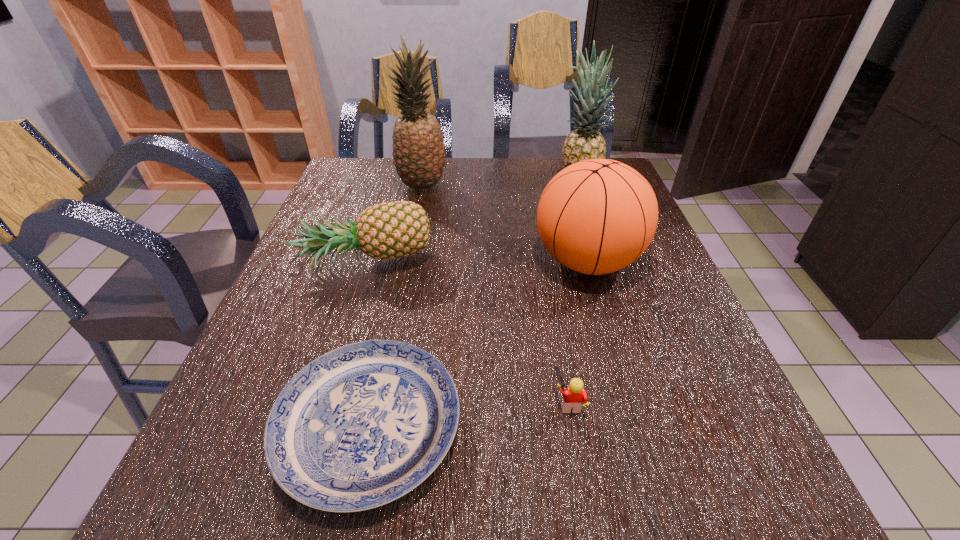
Identify the location of blank area located in front of the Lego with the accessory visible. (462, 402).

Identify the location of vacant space located in front of the Lego with the accessory visible. The height and width of the screenshot is (540, 960). (399, 402).

I want to click on free space located 0.330m on the back of the shortest object, so click(405, 250).

The image size is (960, 540). I want to click on object positioned at the near edge, so click(x=362, y=425).

Identify the location of pineapple at the left edge. The width and height of the screenshot is (960, 540). (389, 230).

The width and height of the screenshot is (960, 540). Find the location of `plate located at the left edge`. plate located at the left edge is located at coordinates (362, 425).

You are a GUI agent. You are given a task and a screenshot of the screen. Output one action in this format:
    pyautogui.click(x=<x>, y=<y>)
    Task: Click on the pineapple at the right edge
    
    Given the screenshot: What is the action you would take?
    pyautogui.click(x=584, y=143)

Image resolution: width=960 pixels, height=540 pixels. Identify the location of basketball present at the right edge. (597, 216).

The width and height of the screenshot is (960, 540). What are the coordinates of `object that is at the near left corner` in the screenshot? It's located at (362, 425).

Image resolution: width=960 pixels, height=540 pixels. What are the coordinates of `object that is at the far right corner` in the screenshot? It's located at (584, 143).